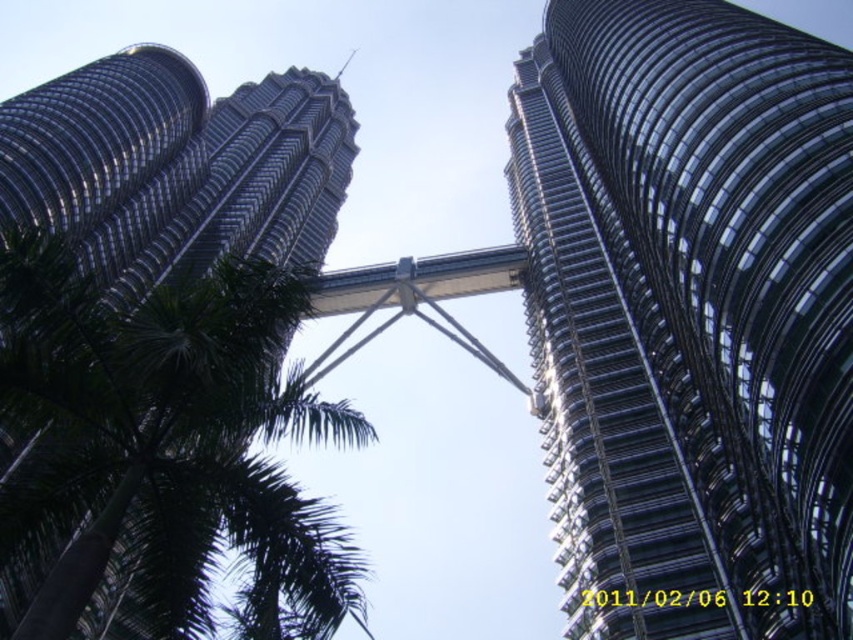
Looking at this image, does glassy steel tower at center have a smaller size compared to shiny metallic tower at upper left?

Yes.

Who is taller, glassy steel tower at center or shiny metallic tower at upper left?

With more height is glassy steel tower at center.

Locate an element on the screen. Image resolution: width=853 pixels, height=640 pixels. glassy steel tower at center is located at coordinates (689, 316).

Locate an element on the screen. Image resolution: width=853 pixels, height=640 pixels. glassy steel tower at center is located at coordinates (689, 316).